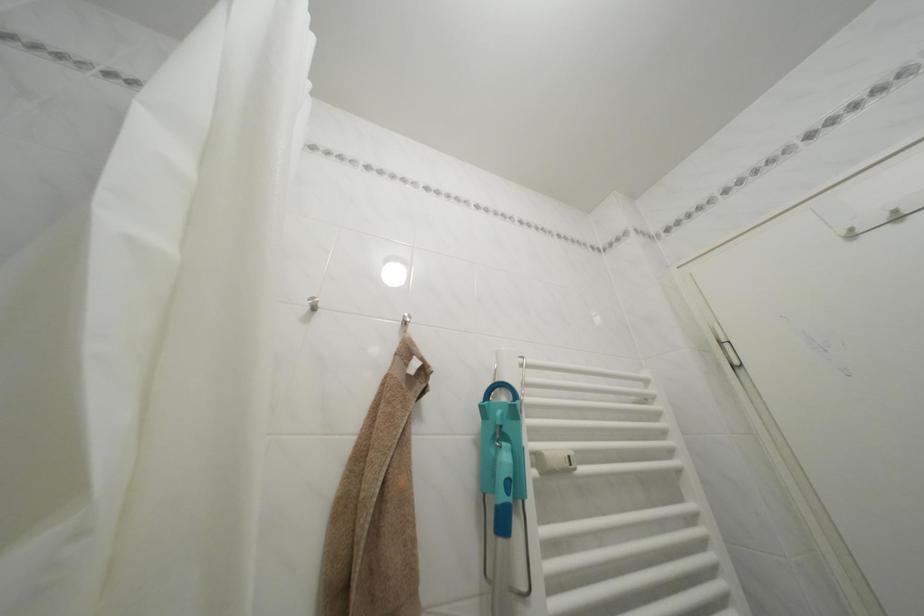
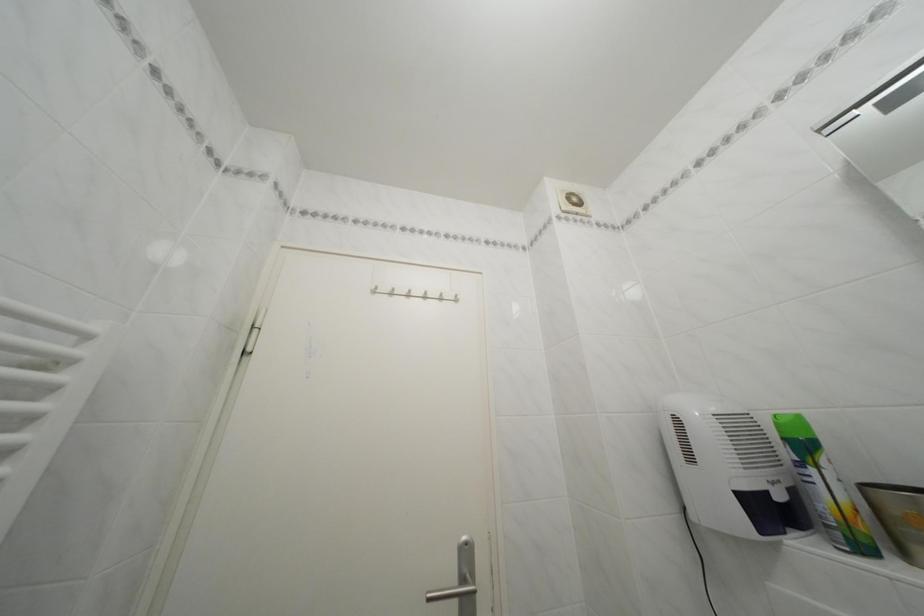
Locate, in the second image, the point that corresponds to pixel 860 236 in the first image.

(385, 294)